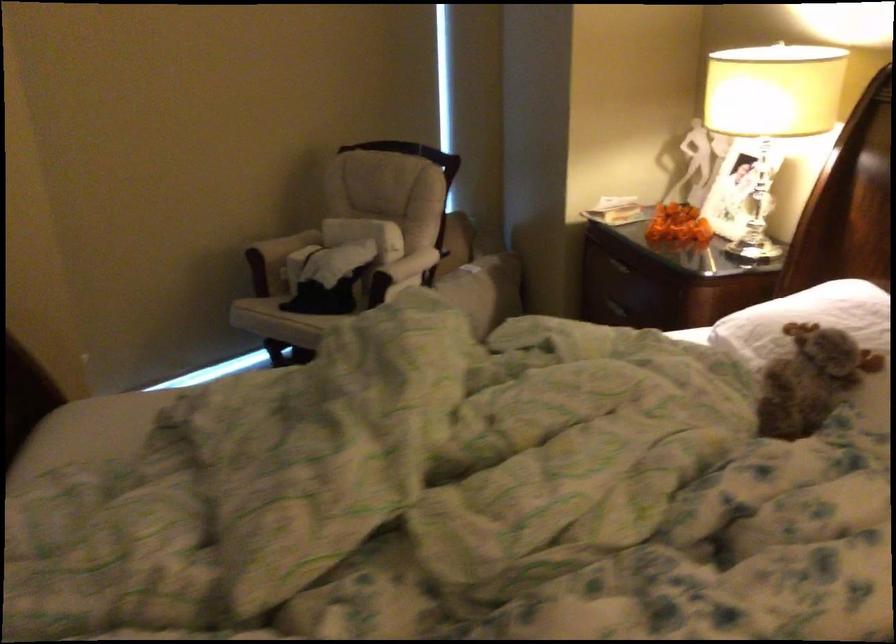
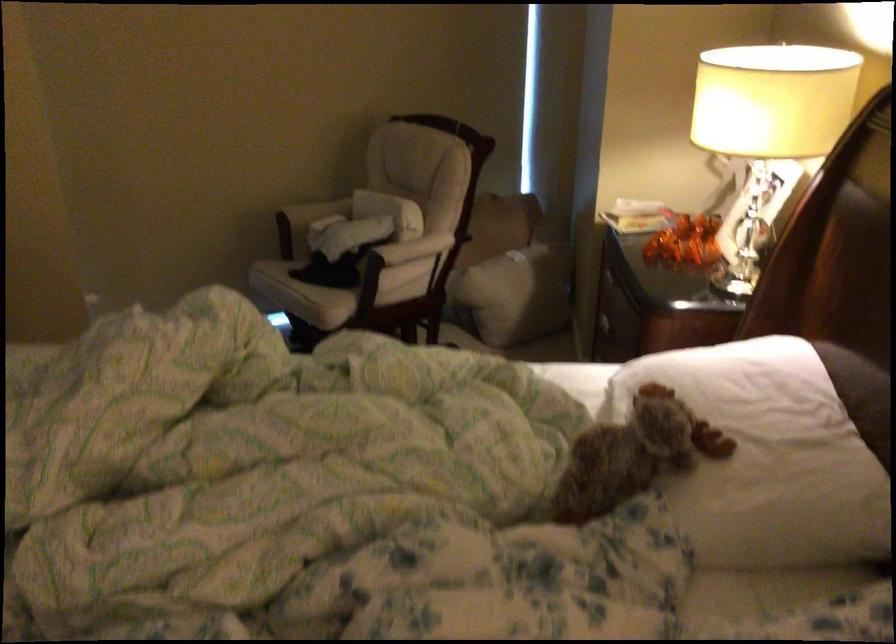
Find the pixel in the second image that matches pixel 295 319 in the first image.

(291, 285)